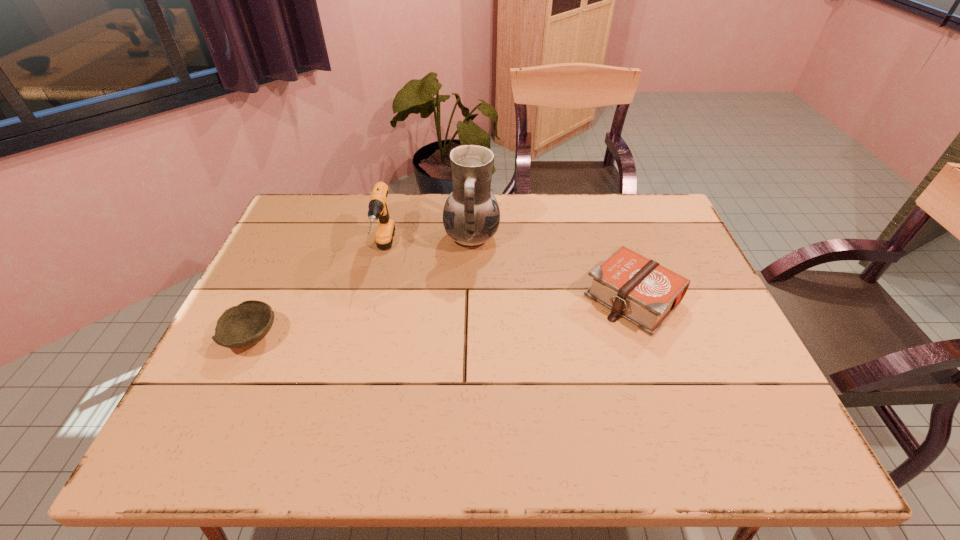
At what (x,y) coordinates should I click in order to perform the action: click on free region at the far right corner of the desktop. Please return your answer as a coordinate pair (x, y). This screenshot has width=960, height=540. Looking at the image, I should click on (646, 212).

The image size is (960, 540). Identify the location of vacant point located between the second object from right to left and the shortest object. (362, 288).

Where is `vacant area that lies between the pitcher and the leftmost object`? vacant area that lies between the pitcher and the leftmost object is located at coordinates (362, 288).

You are a GUI agent. You are given a task and a screenshot of the screen. Output one action in this format:
    pyautogui.click(x=<x>, y=<y>)
    Task: Click on the vacant space that's between the second object from right to left and the second object from left to right
    This screenshot has height=540, width=960.
    Given the screenshot: What is the action you would take?
    pyautogui.click(x=428, y=245)

This screenshot has width=960, height=540. Identify the location of vacant space that's between the third shortest object and the shortest object. (318, 295).

Locate an element on the screen. This screenshot has width=960, height=540. free space between the third object from right to left and the tallest object is located at coordinates (428, 245).

Identify the location of free spot between the third shortest object and the rightmost object. Image resolution: width=960 pixels, height=540 pixels. (509, 275).

Locate an element on the screen. free spot between the Bible and the shortest object is located at coordinates (443, 318).

You are a GUI agent. You are given a task and a screenshot of the screen. Output one action in this format:
    pyautogui.click(x=<x>, y=<y>)
    Task: Click on the unoccupied area between the second object from right to left and the second shortest object
    The width and height of the screenshot is (960, 540).
    Given the screenshot: What is the action you would take?
    pyautogui.click(x=552, y=268)

Locate an element on the screen. The image size is (960, 540). vacant space that's between the leftmost object and the Bible is located at coordinates (443, 318).